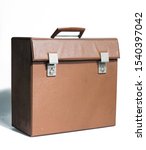
This screenshot has height=150, width=146. I want to click on latch 1, so click(x=51, y=68).